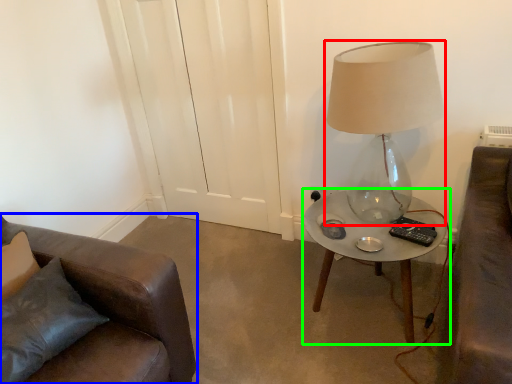
Question: Considering the real-world distances, which object is farthest from lamp (highlighted by a red box)? chair (highlighted by a blue box) or table (highlighted by a green box)?

Choices:
 (A) chair
 (B) table

Answer: (A)